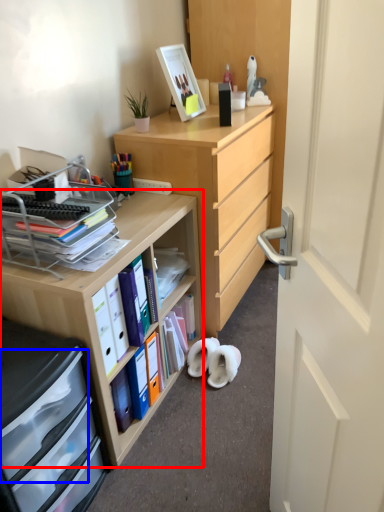
Question: Among these objects, which one is farthest to the camera, desk (highlighted by a red box) or drawer (highlighted by a blue box)?

Choices:
 (A) desk
 (B) drawer

Answer: (A)